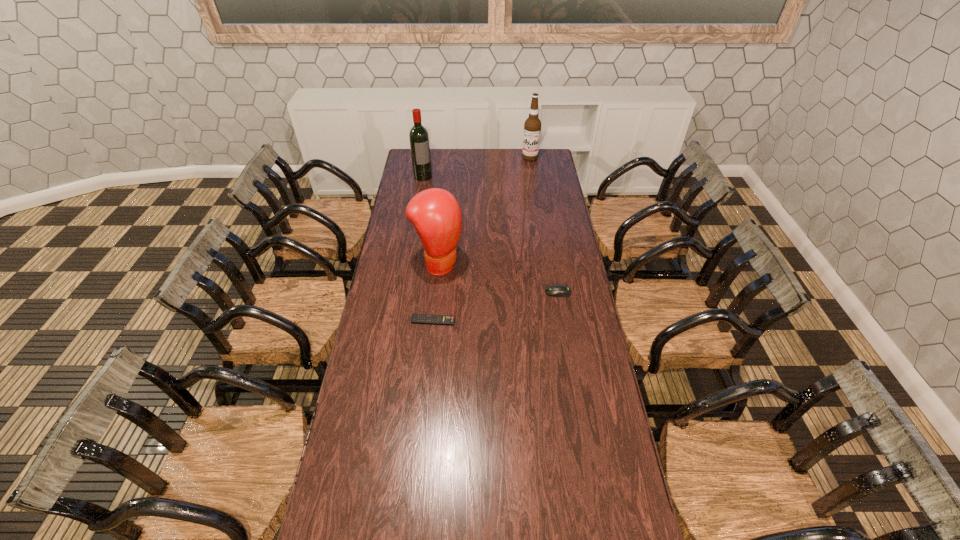
Where is `object situated at the far edge`? The height and width of the screenshot is (540, 960). object situated at the far edge is located at coordinates (532, 127).

The height and width of the screenshot is (540, 960). Find the location of `wine bottle at the left edge`. wine bottle at the left edge is located at coordinates (419, 139).

Find the location of a particular element. Image resolution: width=960 pixels, height=540 pixels. boxing glove at the left edge is located at coordinates (435, 213).

Where is `computer mouse positioned at the right edge`? computer mouse positioned at the right edge is located at coordinates (557, 290).

Locate an element on the screen. The width and height of the screenshot is (960, 540). alcohol present at the right edge is located at coordinates (532, 127).

This screenshot has height=540, width=960. Identify the location of object at the far right corner. (532, 127).

Find the location of a particular element. This screenshot has height=540, width=960. vacant space at the far edge of the desktop is located at coordinates (458, 156).

Locate an element on the screen. The width and height of the screenshot is (960, 540). free space at the near edge of the desktop is located at coordinates (449, 494).

In the image, there is a desktop. Where is `vacant space at the left edge`? The image size is (960, 540). vacant space at the left edge is located at coordinates (387, 356).

In the image, there is a desktop. What are the coordinates of `vacant area at the right edge` in the screenshot? It's located at (552, 185).